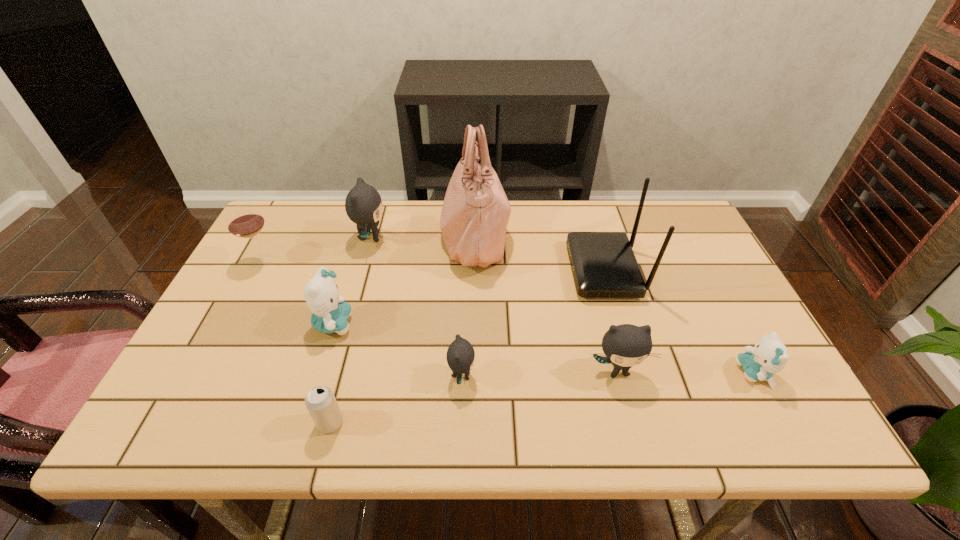
The height and width of the screenshot is (540, 960). I want to click on vacant point located on the front-facing side of the farthest gray kitten, so click(500, 238).

The width and height of the screenshot is (960, 540). In order to click on vacant space located 0.230m on the back of the leftmost object in this screenshot , I will do `click(292, 205)`.

This screenshot has height=540, width=960. Identify the location of free location located on the face of the fourth nearest kitten. (501, 323).

Where is `vacant region located 0.070m on the front-facing side of the second kitten from right to left`? This screenshot has width=960, height=540. vacant region located 0.070m on the front-facing side of the second kitten from right to left is located at coordinates (629, 416).

You are a GUI agent. You are given a task and a screenshot of the screen. Output one action in this format:
    pyautogui.click(x=<x>, y=<y>)
    Task: Click on the free space located on the face of the smaller blue kitten
    
    Given the screenshot: What is the action you would take?
    pyautogui.click(x=579, y=373)

You are a GUI agent. You are given a task and a screenshot of the screen. Output one action in this format:
    pyautogui.click(x=<x>, y=<y>)
    Task: Click on the free region located on the face of the smaller blue kitten
    This screenshot has width=960, height=540.
    Given the screenshot: What is the action you would take?
    pyautogui.click(x=565, y=373)

Locate an element on the screen. Image resolution: width=960 pixels, height=540 pixels. free space located on the face of the smaller blue kitten is located at coordinates (698, 373).

Image resolution: width=960 pixels, height=540 pixels. Find the location of `free space located on the front-facing side of the second gray kitten from right to left`. free space located on the front-facing side of the second gray kitten from right to left is located at coordinates (538, 376).

Locate an element on the screen. The width and height of the screenshot is (960, 540). blank space located 0.050m on the right of the beer can is located at coordinates (368, 422).

Where is `handbag that is at the far edge`? The height and width of the screenshot is (540, 960). handbag that is at the far edge is located at coordinates (475, 213).